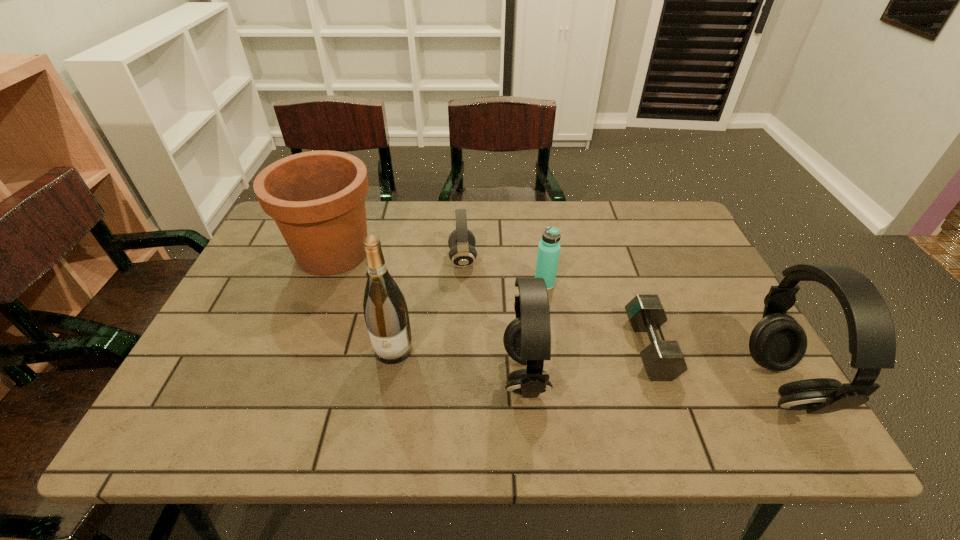
You are a GUI agent. You are given a task and a screenshot of the screen. Output one action in this format:
    pyautogui.click(x=<x>, y=<y>)
    Task: Click on the free space for a new earphone on the left
    Image resolution: width=960 pixels, height=540 pixels.
    Given the screenshot: What is the action you would take?
    pyautogui.click(x=280, y=366)